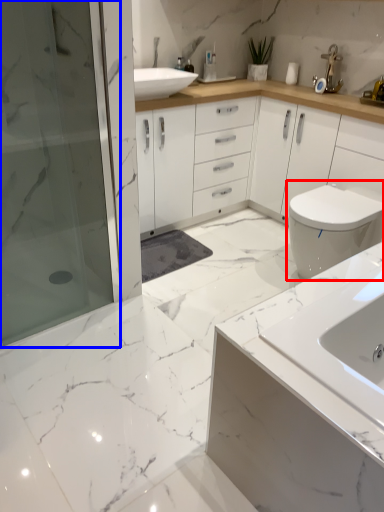
Question: Which of the following is the farthest to the observer, toilet (highlighted by a red box) or shower door (highlighted by a blue box)?

Choices:
 (A) toilet
 (B) shower door

Answer: (A)